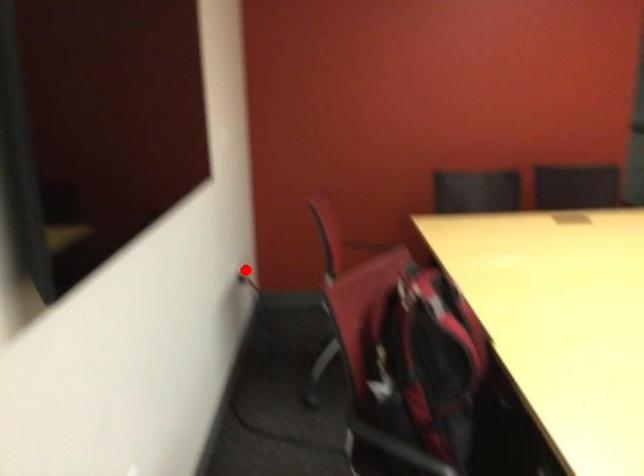
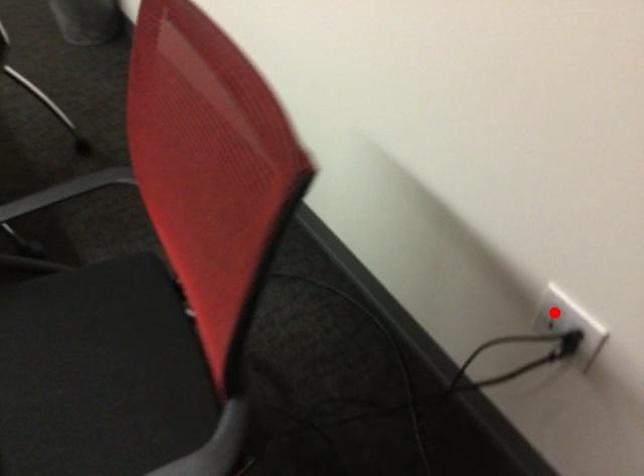
I am providing you with two images of the same scene from different viewpoints. A red point is marked on the first image and another point is marked on the second image. Is the red point in image1 aligned with the point shown in image2?

Yes